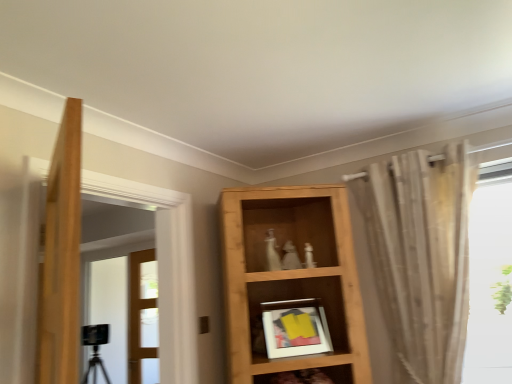
Image resolution: width=512 pixels, height=384 pixels. In order to click on sheer beige curtain at right in this screenshot , I will do `click(421, 255)`.

The width and height of the screenshot is (512, 384). What are the coordinates of `clear glass door at center, marked as the 2th door in a left-to-right arrangement` in the screenshot? It's located at [x=143, y=318].

Locate an element on the screen. The width and height of the screenshot is (512, 384). black glass door at left, positioned as the 1th door in left-to-right order is located at coordinates (126, 315).

Which point is more forward, (334, 370) or (410, 252)?

The point (410, 252) is in front.

From a real-world perspective, does wooden shelf at lower center, which is the second shelf in top-to-bottom order, stand above sheer beige curtain at right?

Actually, wooden shelf at lower center, which is the second shelf in top-to-bottom order, is physically below sheer beige curtain at right in the real world.

Is wooden shelf at lower center, which is the second shelf in top-to-bottom order, bigger or smaller than sheer beige curtain at right?

Considering their sizes, wooden shelf at lower center, which is the second shelf in top-to-bottom order, takes up less space than sheer beige curtain at right.

Are wooden shelf at lower center, which is the second shelf in top-to-bottom order, and sheer beige curtain at right far apart?

wooden shelf at lower center, which is the second shelf in top-to-bottom order, is positioned a significant distance from sheer beige curtain at right.

Is sheer beige curtain at right oriented towards black glass door at left, positioned as the 2th door in right-to-left order?

No.

Is sheer beige curtain at right far away from black glass door at left, positioned as the 1th door in left-to-right order?

Yes, sheer beige curtain at right and black glass door at left, positioned as the 1th door in left-to-right order, are located far from each other.

Does sheer beige curtain at right have a greater width compared to black glass door at left, positioned as the 2th door in right-to-left order?

Yes, sheer beige curtain at right is wider than black glass door at left, positioned as the 2th door in right-to-left order.

What's the angular difference between sheer beige curtain at right and black glass door at left, positioned as the 1th door in left-to-right order,'s facing directions?

There is a 0.817-degree angle between the facing directions of sheer beige curtain at right and black glass door at left, positioned as the 1th door in left-to-right order.

From the image's perspective, relative to clear glass door at center, marked as the 2th door in a left-to-right arrangement, is wooden shelf at center, the first shelf when ordered from top to bottom, above or below?

Based on their image positions, wooden shelf at center, the first shelf when ordered from top to bottom, is located above clear glass door at center, marked as the 2th door in a left-to-right arrangement.

Looking at this image, which of these two, wooden shelf at center, the first shelf when ordered from top to bottom, or clear glass door at center, marked as the 2th door in a left-to-right arrangement, is bigger?

Bigger between the two is wooden shelf at center, the first shelf when ordered from top to bottom.

Is the surface of wooden shelf at center, which ranks as the second shelf in bottom-to-top order, in direct contact with clear glass door at center, marked as the 2th door in a left-to-right arrangement?

No, wooden shelf at center, which ranks as the second shelf in bottom-to-top order, is not with clear glass door at center, marked as the 2th door in a left-to-right arrangement.

Could you tell me if wooden shelf at center, which ranks as the second shelf in bottom-to-top order, is facing wooden shelf at lower center, acting as the first shelf starting from the bottom?

Yes, wooden shelf at center, which ranks as the second shelf in bottom-to-top order, is oriented towards wooden shelf at lower center, acting as the first shelf starting from the bottom.

From a real-world perspective, is wooden shelf at center, the first shelf when ordered from top to bottom, located higher than wooden shelf at lower center, which is the second shelf in top-to-bottom order?

Yes.

How different are the orientations of wooden shelf at center, the first shelf when ordered from top to bottom, and wooden shelf at lower center, acting as the first shelf starting from the bottom, in degrees?

The angular difference between wooden shelf at center, the first shelf when ordered from top to bottom, and wooden shelf at lower center, acting as the first shelf starting from the bottom, is 0.000183 degrees.

Which of these two, wooden shelf at center, which ranks as the second shelf in bottom-to-top order, or wooden shelf at lower center, which is the second shelf in top-to-bottom order, stands taller?

wooden shelf at center, which ranks as the second shelf in bottom-to-top order, is taller.

Identify the location of the 2nd shelf behind the sheer beige curtain at right, starting your count from the anchor. This screenshot has width=512, height=384. (292, 276).

From the image's perspective, which one is positioned higher, sheer beige curtain at right or wooden shelf at center, the first shelf when ordered from top to bottom?

sheer beige curtain at right, from the image's perspective.

Does sheer beige curtain at right appear on the right side of wooden shelf at center, the first shelf when ordered from top to bottom?

Yes, sheer beige curtain at right is to the right of wooden shelf at center, the first shelf when ordered from top to bottom.

Which object is further away from the camera taking this photo, sheer beige curtain at right or wooden shelf at center, which ranks as the second shelf in bottom-to-top order?

wooden shelf at center, which ranks as the second shelf in bottom-to-top order, is behind.

From a real-world perspective, who is located higher, wooden shelf at lower center, acting as the first shelf starting from the bottom, or black glass door at left, positioned as the 1th door in left-to-right order?

black glass door at left, positioned as the 1th door in left-to-right order, is physically above.

Is black glass door at left, positioned as the 2th door in right-to-left order, at the back of wooden shelf at lower center, acting as the first shelf starting from the bottom?

Absolutely, wooden shelf at lower center, acting as the first shelf starting from the bottom, is directed away from black glass door at left, positioned as the 2th door in right-to-left order.

Is wooden shelf at lower center, which is the second shelf in top-to-bottom order, next to black glass door at left, positioned as the 1th door in left-to-right order?

wooden shelf at lower center, which is the second shelf in top-to-bottom order, and black glass door at left, positioned as the 1th door in left-to-right order, are not in contact.

From the image's perspective, would you say wooden shelf at lower center, acting as the first shelf starting from the bottom, is shown under black glass door at left, positioned as the 2th door in right-to-left order?

No.

Locate an element on the screen. shelf above the black glass door at left, positioned as the 2th door in right-to-left order (from a real-world perspective) is located at coordinates (292, 276).

From the image's perspective, which one is positioned higher, wooden shelf at center, which ranks as the second shelf in bottom-to-top order, or black glass door at left, positioned as the 1th door in left-to-right order?

wooden shelf at center, which ranks as the second shelf in bottom-to-top order.

Between point (335, 365) and point (148, 338), which one is positioned in front?

The point (335, 365) is more forward.

From a real-world perspective, which shelf is the 2nd one underneath the sheer beige curtain at right? Please provide its 2D coordinates.

[(339, 373)]

From the image's perspective, which door is the 2nd one below the sheer beige curtain at right? Please provide its 2D coordinates.

[(126, 315)]

Estimate the real-world distances between objects in this image. Which object is closer to wooden shelf at lower center, which is the second shelf in top-to-bottom order, wooden shelf at center, which ranks as the second shelf in bottom-to-top order, or black glass door at left, positioned as the 2th door in right-to-left order?

wooden shelf at center, which ranks as the second shelf in bottom-to-top order, lies closer to wooden shelf at lower center, which is the second shelf in top-to-bottom order, than the other object.

Considering their positions, is sheer beige curtain at right positioned closer to wooden shelf at lower center, which is the second shelf in top-to-bottom order, than clear glass door at center, marked as the 2th door in a left-to-right arrangement?

sheer beige curtain at right.

Which object lies further to the anchor point wooden shelf at center, the first shelf when ordered from top to bottom, sheer beige curtain at right or wooden shelf at lower center, which is the second shelf in top-to-bottom order?

wooden shelf at lower center, which is the second shelf in top-to-bottom order, is further to wooden shelf at center, the first shelf when ordered from top to bottom.

When comparing their distances from clear glass door at center, the first door positioned from the right, does sheer beige curtain at right or black glass door at left, positioned as the 1th door in left-to-right order, seem further?

→ sheer beige curtain at right lies further to clear glass door at center, the first door positioned from the right, than the other object.

Looking at the image, which one is located further to wooden shelf at center, the first shelf when ordered from top to bottom, black glass door at left, positioned as the 1th door in left-to-right order, or clear glass door at center, marked as the 2th door in a left-to-right arrangement?

black glass door at left, positioned as the 1th door in left-to-right order.

When comparing their distances from black glass door at left, positioned as the 2th door in right-to-left order, does wooden shelf at lower center, acting as the first shelf starting from the bottom, or wooden shelf at center, which ranks as the second shelf in bottom-to-top order, seem further?

The object further to black glass door at left, positioned as the 2th door in right-to-left order, is wooden shelf at center, which ranks as the second shelf in bottom-to-top order.

Looking at the image, which one is located further to black glass door at left, positioned as the 2th door in right-to-left order, wooden shelf at lower center, acting as the first shelf starting from the bottom, or sheer beige curtain at right?

sheer beige curtain at right lies further to black glass door at left, positioned as the 2th door in right-to-left order, than the other object.

Consider the image. Estimate the real-world distances between objects in this image. Which object is closer to clear glass door at center, the first door positioned from the right, sheer beige curtain at right or wooden shelf at lower center, which is the second shelf in top-to-bottom order?

wooden shelf at lower center, which is the second shelf in top-to-bottom order, lies closer to clear glass door at center, the first door positioned from the right, than the other object.

Identify the location of shelf located between wooden shelf at lower center, acting as the first shelf starting from the bottom, and black glass door at left, positioned as the 1th door in left-to-right order, in the depth direction. This screenshot has width=512, height=384. (292, 276).

Find the location of a particular element. door located between wooden shelf at lower center, acting as the first shelf starting from the bottom, and clear glass door at center, the first door positioned from the right, in the depth direction is located at coordinates (126, 315).

Image resolution: width=512 pixels, height=384 pixels. I want to click on door between wooden shelf at center, which ranks as the second shelf in bottom-to-top order, and clear glass door at center, the first door positioned from the right, along the z-axis, so click(x=126, y=315).

Where is `shelf located between wooden shelf at center, which ranks as the second shelf in bottom-to-top order, and sheer beige curtain at right in the left-right direction`? Image resolution: width=512 pixels, height=384 pixels. shelf located between wooden shelf at center, which ranks as the second shelf in bottom-to-top order, and sheer beige curtain at right in the left-right direction is located at coordinates [x=339, y=373].